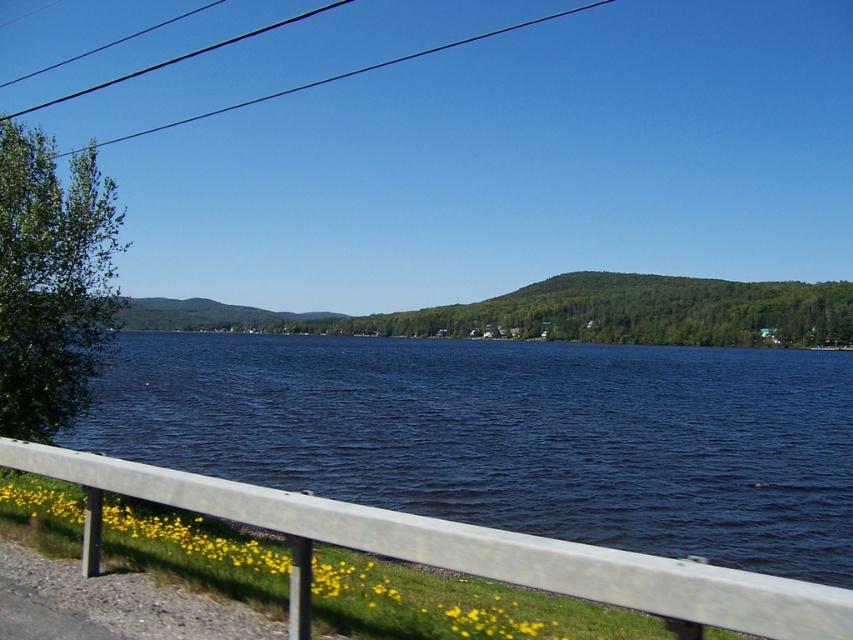
Question: Does silver metallic rail at lower center appear under black wire at upper left?

Choices:
 (A) no
 (B) yes

Answer: (B)

Question: Considering the real-world distances, which object is farthest from the blue water at center?

Choices:
 (A) silver metallic rail at lower center
 (B) black wire at upper left

Answer: (B)

Question: Which object appears farthest from the camera in this image?

Choices:
 (A) black wire at upper left
 (B) blue water at center

Answer: (A)

Question: Can you confirm if blue water at center is positioned above silver metallic rail at lower center?

Choices:
 (A) no
 (B) yes

Answer: (A)

Question: Estimate the real-world distances between objects in this image. Which object is closer to the silver metallic rail at lower center?

Choices:
 (A) black wire at upper left
 (B) blue water at center

Answer: (B)

Question: Is blue water at center thinner than silver metallic rail at lower center?

Choices:
 (A) no
 (B) yes

Answer: (A)